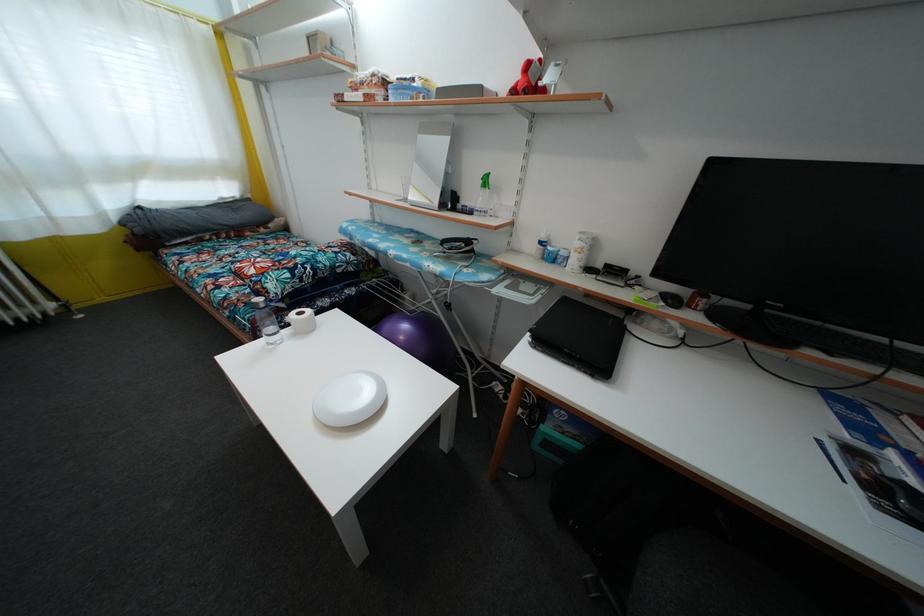
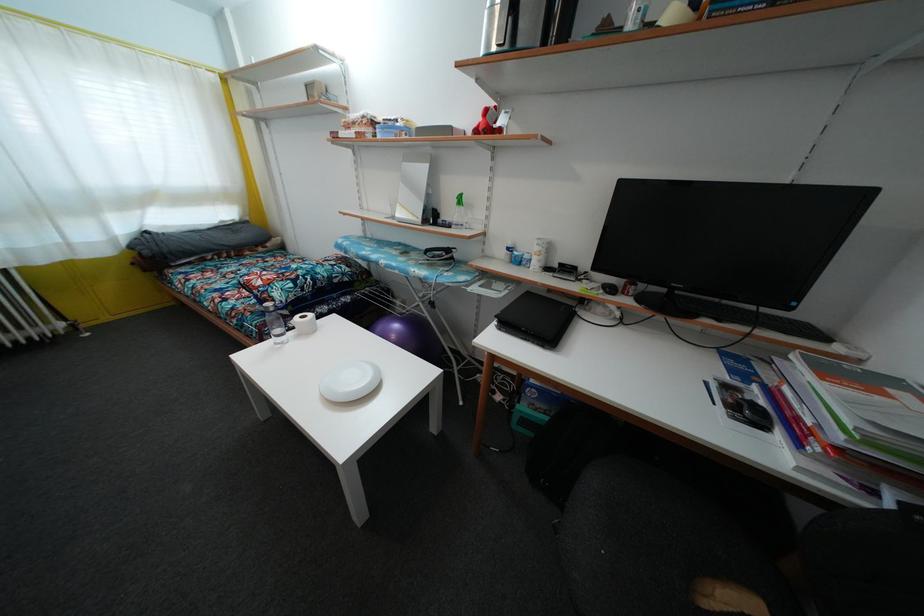
Find the pixel in the second image that matches (x=428, y=136) in the first image.

(410, 164)